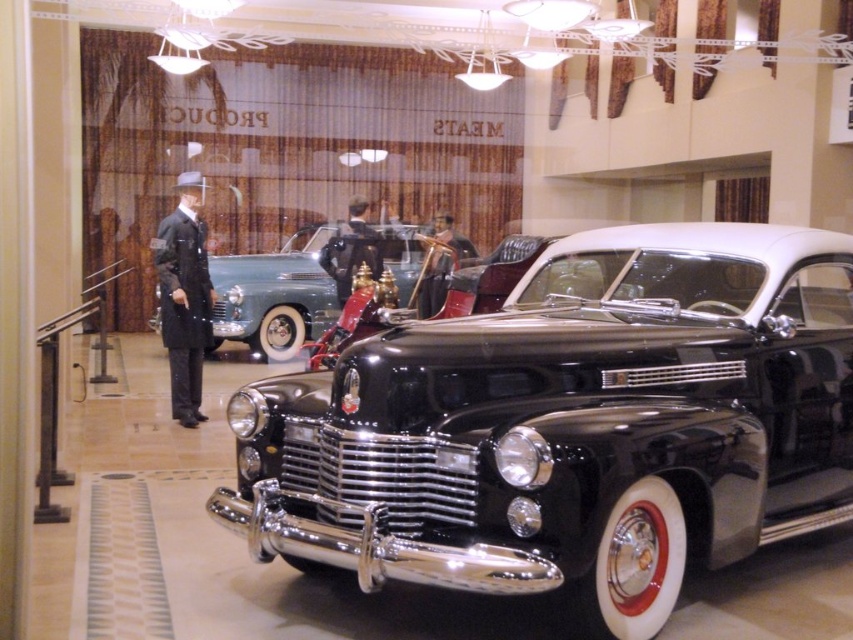
Question: Which object is the farthest from the shiny chrome pickup at center?

Choices:
 (A) shiny black car at center
 (B) smooth leather jacket at center
 (C) matte black suit at left

Answer: (A)

Question: Does shiny black car at center have a lesser width compared to smooth leather jacket at center?

Choices:
 (A) no
 (B) yes

Answer: (A)

Question: Among these objects, which one is farthest from the camera?

Choices:
 (A) shiny black car at center
 (B) smooth leather jacket at center
 (C) shiny chrome pickup at center

Answer: (A)

Question: Which point is closer to the camera?

Choices:
 (A) shiny black car at center
 (B) shiny chrome pickup at center

Answer: (B)

Question: Can you confirm if shiny chrome pickup at center is thinner than smooth leather jacket at center?

Choices:
 (A) yes
 (B) no

Answer: (B)

Question: Is shiny chrome pickup at center smaller than matte black suit at left?

Choices:
 (A) yes
 (B) no

Answer: (B)